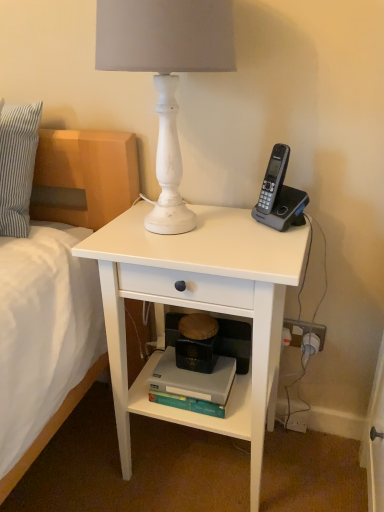
Identify the location of vacant space situated on the left part of gray plastic phone at upper right. The height and width of the screenshot is (512, 384). (213, 225).